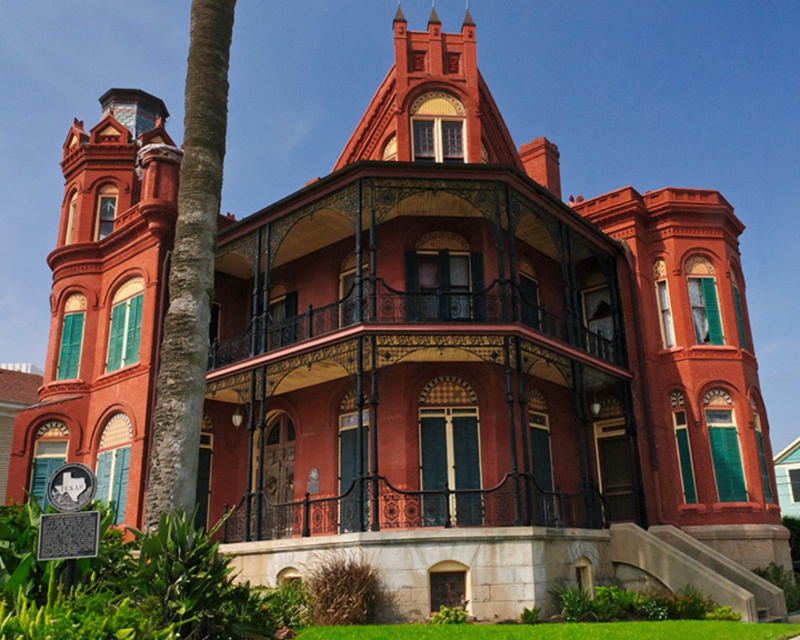
Is point (264, 308) closer to viewer compared to point (578, 522)?

No, it is not.

Who is taller, matte red balcony at center or polished wrought iron porch at center?

matte red balcony at center is taller.

Where is `matte red balcony at center`? matte red balcony at center is located at coordinates (417, 362).

Where is `matte red balcony at center`? matte red balcony at center is located at coordinates (417, 362).

Does point (218, 372) come behind point (162, 426)?

Yes.

Does matte red balcony at center appear on the left side of green textured palm tree at left?

Incorrect, matte red balcony at center is not on the left side of green textured palm tree at left.

Which is in front, point (350, 445) or point (164, 352)?

Positioned in front is point (164, 352).

What are the coordinates of `matte red balcony at center` in the screenshot? It's located at click(x=417, y=362).

Is green textured palm tree at left thinner than polished wrought iron porch at center?

Yes.

Is green textured palm tree at left smaller than polished wrought iron porch at center?

Incorrect, green textured palm tree at left is not smaller in size than polished wrought iron porch at center.

You are a GUI agent. You are given a task and a screenshot of the screen. Output one action in this format:
    pyautogui.click(x=<x>, y=<y>)
    Task: Click on the green textured palm tree at left
    
    Given the screenshot: What is the action you would take?
    pyautogui.click(x=190, y=268)